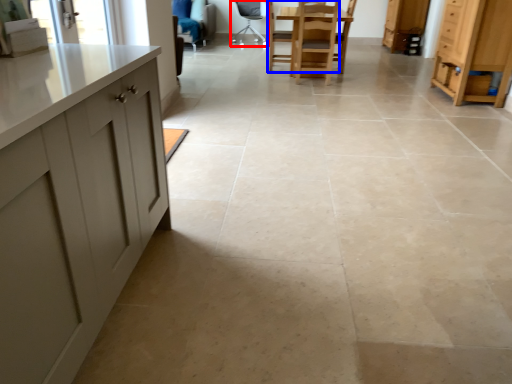
Question: Which object is further to the camera taking this photo, chair (highlighted by a red box) or chair (highlighted by a blue box)?

Choices:
 (A) chair
 (B) chair

Answer: (A)